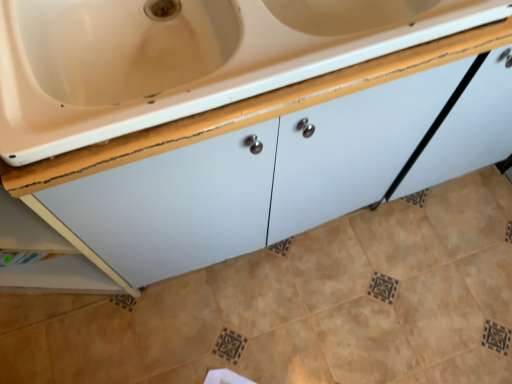
Question: Is beige ceramic tile at center spatially inside white glossy cabinet at center, or outside of it?

Choices:
 (A) inside
 (B) outside

Answer: (B)

Question: Is point (411, 360) positioned closer to the camera than point (189, 132)?

Choices:
 (A) farther
 (B) closer

Answer: (A)

Question: From a real-world perspective, relative to white glossy cabinet at center, is beige ceramic tile at center vertically above or below?

Choices:
 (A) above
 (B) below

Answer: (B)

Question: Is point (439, 61) positioned closer to the camera than point (381, 225)?

Choices:
 (A) closer
 (B) farther

Answer: (A)

Question: Is white glossy cabinet at center wider or thinner than beige ceramic tile at center?

Choices:
 (A) wide
 (B) thin

Answer: (B)

Question: In terms of height, does white glossy cabinet at center look taller or shorter compared to beige ceramic tile at center?

Choices:
 (A) short
 (B) tall

Answer: (B)

Question: Considering their positions, is white glossy cabinet at center located in front of or behind beige ceramic tile at center?

Choices:
 (A) behind
 (B) front

Answer: (B)